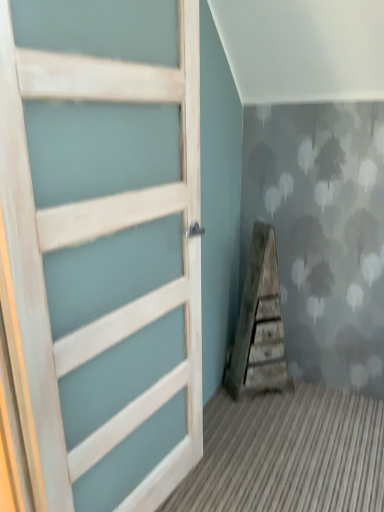
Question: Choose the correct answer: Is weathered wood staircase at center inside white wood door at left or outside it?

Choices:
 (A) inside
 (B) outside

Answer: (B)

Question: Is point (268, 259) positioned closer to the camera than point (102, 316)?

Choices:
 (A) farther
 (B) closer

Answer: (A)

Question: Looking at their shapes, would you say weathered wood staircase at center is wider or thinner than white wood door at left?

Choices:
 (A) wide
 (B) thin

Answer: (A)

Question: Is white wood door at left inside or outside of weathered wood staircase at center?

Choices:
 (A) outside
 (B) inside

Answer: (A)

Question: From the image's perspective, is white wood door at left located above or below weathered wood staircase at center?

Choices:
 (A) below
 (B) above

Answer: (B)

Question: Is white wood door at left wider or thinner than weathered wood staircase at center?

Choices:
 (A) wide
 (B) thin

Answer: (B)

Question: Considering the positions of point (132, 122) and point (251, 286), is point (132, 122) closer or farther from the camera than point (251, 286)?

Choices:
 (A) closer
 (B) farther

Answer: (A)